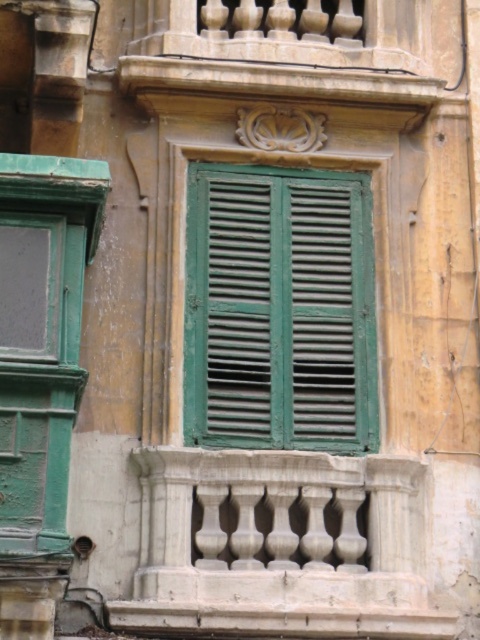
You are a painter who needs to know which object is shorter between the green matte shutters at center and the green matte door at left. Based on the scene, which one is shorter?

The green matte shutters at center is not as tall as the green matte door at left, so the shutters are shorter.

You are standing in front of an old building and want to touch the green matte shutters at center. Considering your arm can reach up to 2 meters, can you reach them without moving closer?

The green matte shutters at center is 204.16 feet from viewer. Since 204.16 feet is much farther than 2 meters, you cannot reach them with your arm.

You are standing in front of an old building and notice a point at coordinates (279,308). Based on the scene description, what object is located at that point?

The point at coordinates (279,308) corresponds to the green matte shutters at center.